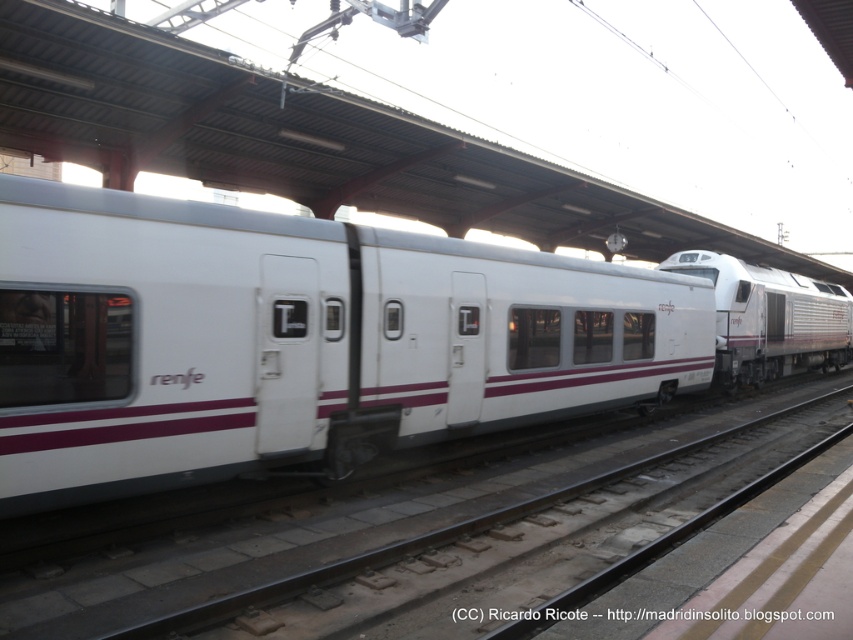
You are a photographer standing at the train station and want to take a photo of the white glossy train car at center. If you are positioned at point 0.5, 0.5, will you be able to see the entire train car in your camera frame?

The white glossy train car at center is located at point (294, 340). Since your position is at (426, 320), you are slightly to the left and above the train car. Depending on the camera angle and zoom, you might need to adjust your position or zoom out to ensure the entire train car fits within the frame.

You are a maintenance worker at the train station. You need to inspect the white glossy train car at center and the white glossy train at center. The safety protocol requires that you must keep a minimum distance of 10 meters between yourself and any train while inspecting. If you stand exactly between them, will you be following the safety protocol?

The white glossy train car at center is 8.09 meters from white glossy train at center. If you stand exactly between them, the distance from you to each train would be half of 8.09 meters, which is approximately 4.045 meters. Since this is less than the required 10 meters, you would not be following the safety protocol.